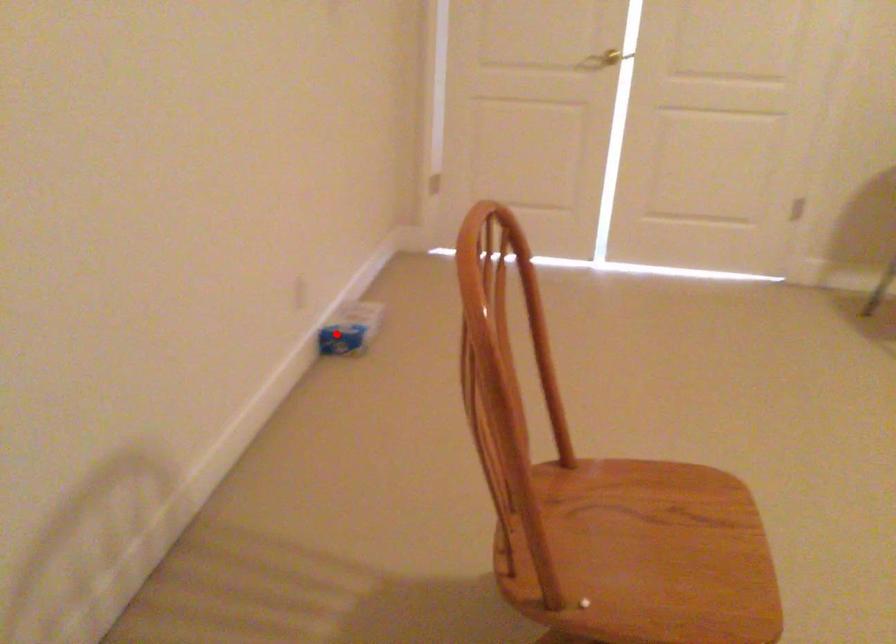
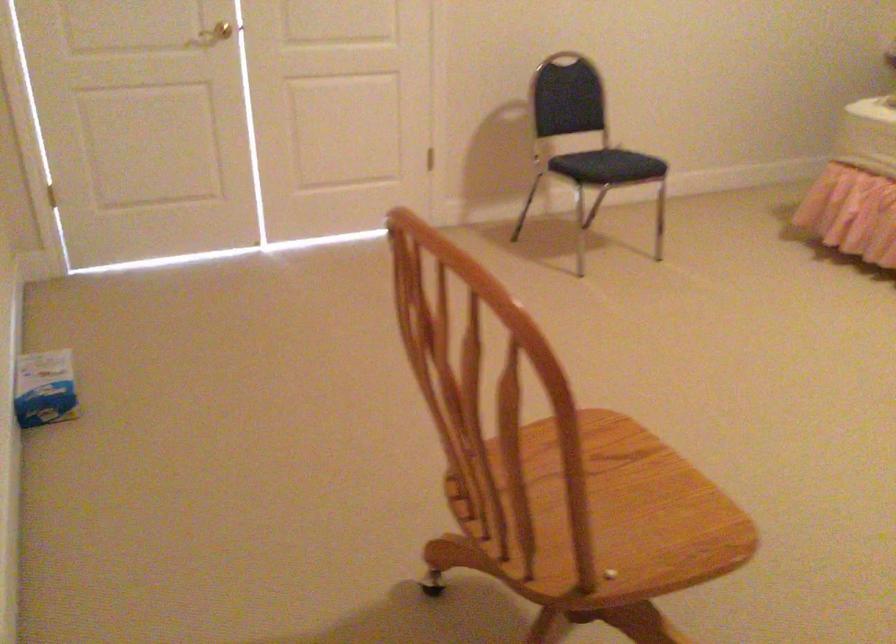
Question: I am providing you with two images of the same scene from different viewpoints. Given a red point in image1, look at the same physical point in image2. Is it:

Choices:
 (A) Closer to the viewpoint
 (B) Farther from the viewpoint

Answer: (A)